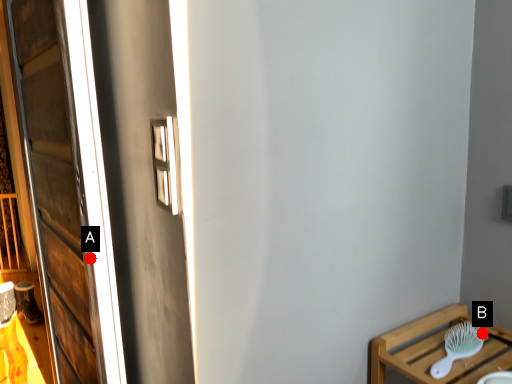
Question: Two points are circled on the image, labeled by A and B beside each circle. Among these points, which one is nearest to the camera?

Choices:
 (A) A is closer
 (B) B is closer

Answer: (A)